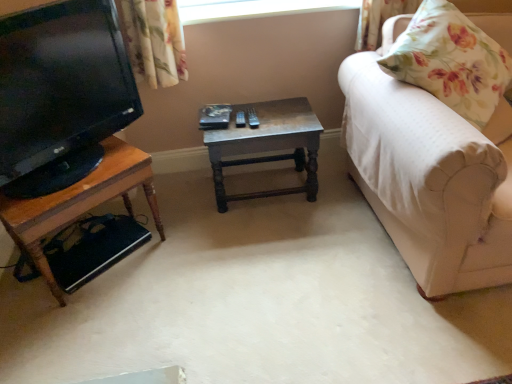
You are a GUI agent. You are given a task and a screenshot of the screen. Output one action in this format:
    pyautogui.click(x=<x>, y=<y>)
    Task: Click on the free space in front of wooden table at center, acting as the first table starting from the right
    
    Given the screenshot: What is the action you would take?
    pyautogui.click(x=270, y=238)